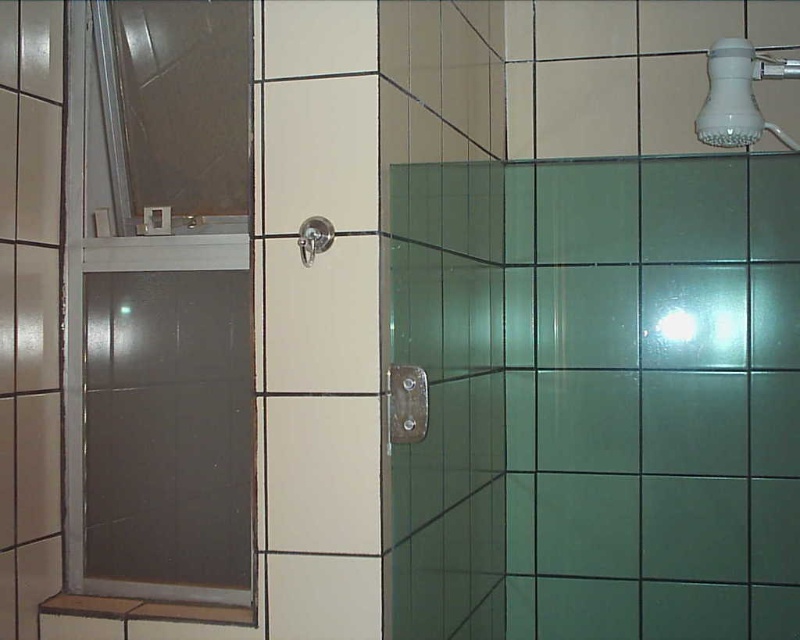
Is point (716, 52) closer to viewer compared to point (306, 241)?

No, (716, 52) is further to viewer.

How far apart are white plastic shower head at upper right and satin nickel showerhead at upper center?

31.11 inches

The height and width of the screenshot is (640, 800). What do you see at coordinates (738, 96) in the screenshot?
I see `white plastic shower head at upper right` at bounding box center [738, 96].

Locate an element on the screen. The image size is (800, 640). white plastic shower head at upper right is located at coordinates (738, 96).

Between frosted glass door at left and satin nickel showerhead at upper center, which one has less height?

With less height is satin nickel showerhead at upper center.

Does frosted glass door at left appear on the left side of satin nickel showerhead at upper center?

Indeed, frosted glass door at left is positioned on the left side of satin nickel showerhead at upper center.

Who is more forward, (186, 534) or (302, 236)?

Point (302, 236) is more forward.

In order to click on frosted glass door at left in this screenshot , I will do `click(160, 301)`.

Is frosted glass door at left bigger than white plastic shower head at upper right?

Indeed, frosted glass door at left has a larger size compared to white plastic shower head at upper right.

Between frosted glass door at left and white plastic shower head at upper right, which one is positioned higher?

white plastic shower head at upper right

Is point (117, 214) positioned in front of point (713, 93)?

Yes.

This screenshot has height=640, width=800. Find the location of `frosted glass door at left`. frosted glass door at left is located at coordinates (160, 301).